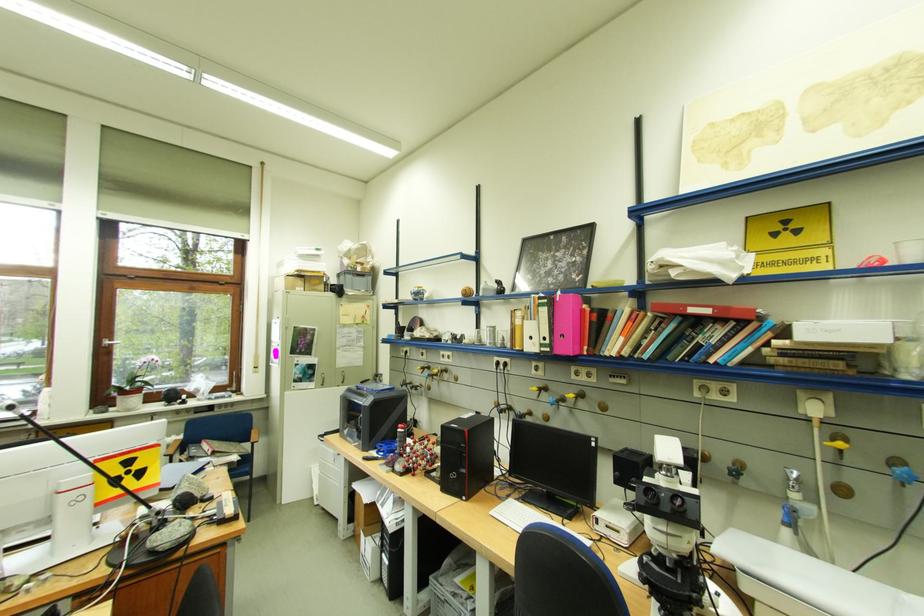
Locate an element on the screen. spray bottle trigger is located at coordinates (593, 509).